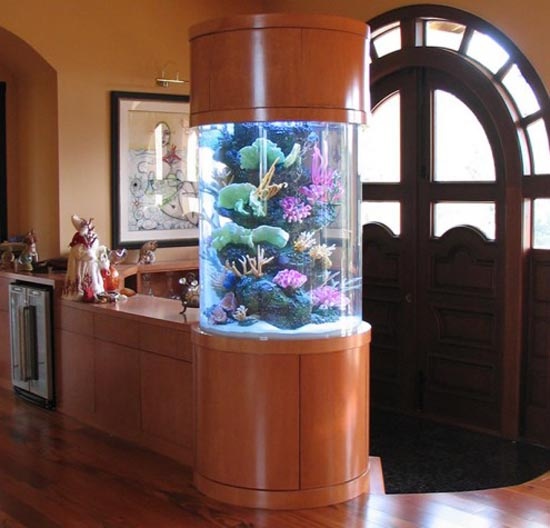
Image resolution: width=550 pixels, height=528 pixels. Find the location of `light brown wall`. light brown wall is located at coordinates (82, 158).